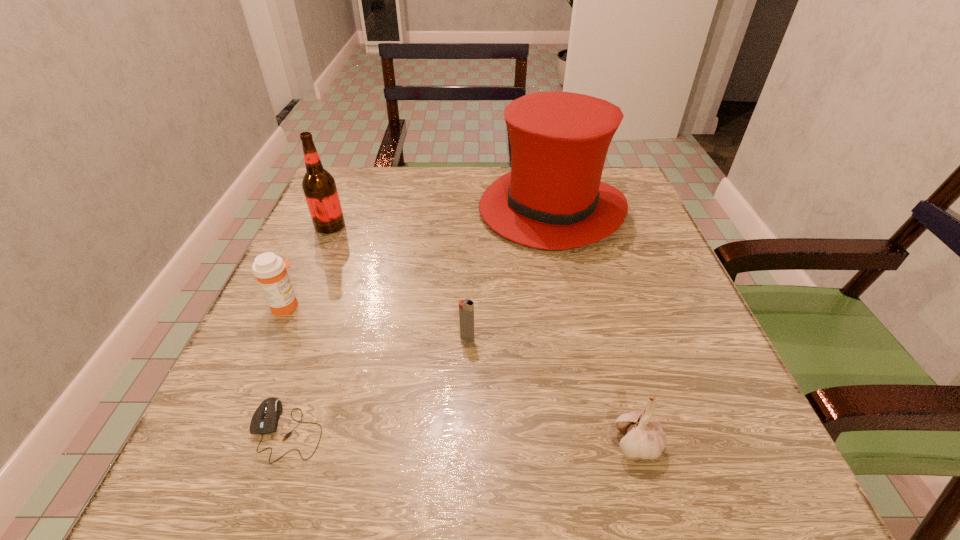
Locate an element on the screen. computer mouse at the left edge is located at coordinates (265, 419).

Where is `hat located in the right edge section of the desktop`? The width and height of the screenshot is (960, 540). hat located in the right edge section of the desktop is located at coordinates click(553, 198).

Find the location of a particular element. garlic present at the right edge is located at coordinates (644, 438).

The image size is (960, 540). In order to click on object that is at the far left corner in this screenshot , I will do `click(319, 187)`.

You are a GUI agent. You are given a task and a screenshot of the screen. Output one action in this format:
    pyautogui.click(x=<x>, y=<y>)
    Task: Click on the object that is at the near left corner
    
    Given the screenshot: What is the action you would take?
    pyautogui.click(x=265, y=419)

Identify the location of object present at the far right corner. (553, 198).

At what (x,y) coordinates should I click in order to perform the action: click on object that is positioned at the near right corner. Please return your answer as a coordinate pair (x, y). Looking at the image, I should click on (644, 438).

Locate an element on the screen. This screenshot has width=960, height=540. free space at the far edge is located at coordinates (453, 187).

The width and height of the screenshot is (960, 540). I want to click on free location at the near edge, so click(x=552, y=487).

You are a GUI agent. You are given a task and a screenshot of the screen. Output one action in this format:
    pyautogui.click(x=<x>, y=<y>)
    Task: Click on the free space at the left edge
    This screenshot has width=960, height=540.
    Given the screenshot: What is the action you would take?
    pyautogui.click(x=282, y=390)